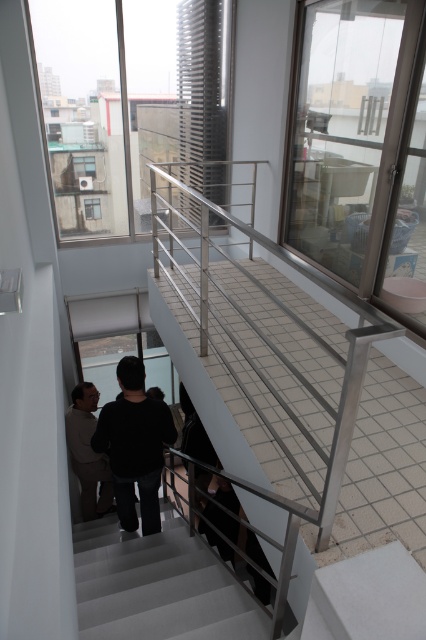
Question: Does gray matte stair at center appear on the right side of light brown leather jacket at lower left?

Choices:
 (A) no
 (B) yes

Answer: (B)

Question: Among these objects, which one is farthest from the camera?

Choices:
 (A) black matte sweater at center
 (B) gray matte stair at center
 (C) light brown leather jacket at lower left

Answer: (C)

Question: Which of the following is the closest to the observer?

Choices:
 (A) gray matte stair at center
 (B) black matte sweater at center
 (C) light brown leather jacket at lower left

Answer: (A)

Question: Which object appears closest to the camera in this image?

Choices:
 (A) light brown leather jacket at lower left
 (B) black matte sweater at center
 (C) gray matte stair at center

Answer: (C)

Question: Observing the image, what is the correct spatial positioning of black matte sweater at center in reference to light brown leather jacket at lower left?

Choices:
 (A) below
 (B) above

Answer: (B)

Question: Can you confirm if black matte sweater at center is bigger than light brown leather jacket at lower left?

Choices:
 (A) yes
 (B) no

Answer: (A)